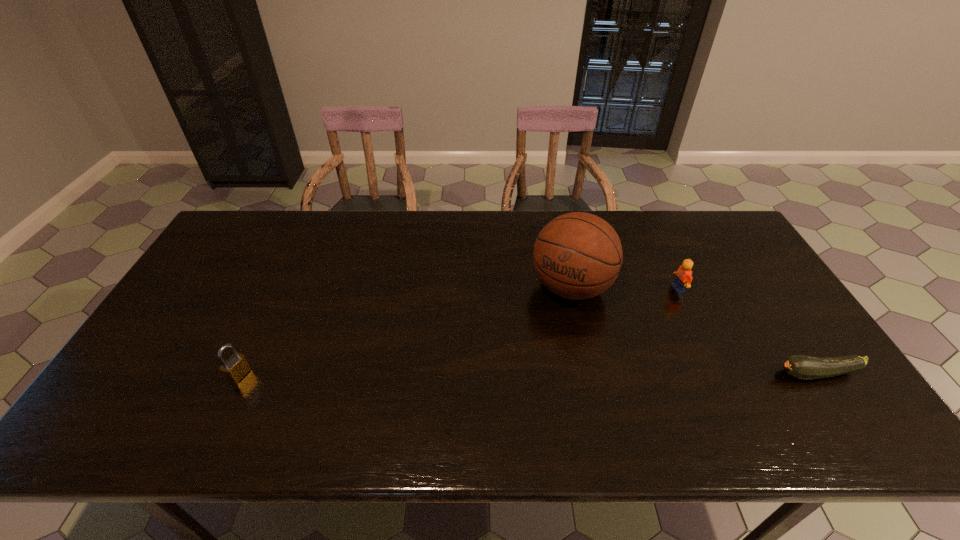
Find the location of `vacant region at the far edge of the desktop`. vacant region at the far edge of the desktop is located at coordinates (426, 214).

The width and height of the screenshot is (960, 540). In order to click on vacant space at the near edge of the desktop in this screenshot , I will do `click(689, 393)`.

I want to click on free region at the right edge of the desktop, so click(x=742, y=259).

The image size is (960, 540). In the image, there is a desktop. What are the coordinates of `vacant space at the far left corner` in the screenshot? It's located at (242, 220).

Find the location of `free space at the far right corner`. free space at the far right corner is located at coordinates (720, 217).

Identify the location of vacant point located between the padlock and the Lego. (459, 332).

At what (x,y) coordinates should I click in order to perform the action: click on free space between the padlock and the shortest object. Please return your answer as a coordinate pair (x, y). Looking at the image, I should click on (529, 374).

This screenshot has width=960, height=540. Identify the location of vacant area between the third object from left to right and the leftmost object. (459, 332).

The image size is (960, 540). Identify the location of vacant space that's between the basketball and the second object from right to left. (625, 288).

The width and height of the screenshot is (960, 540). What are the coordinates of `vacant space that is in between the second object from right to left and the rightmost object` in the screenshot? It's located at (748, 331).